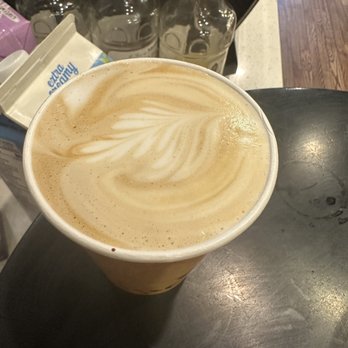
I want to click on table, so click(x=292, y=47).